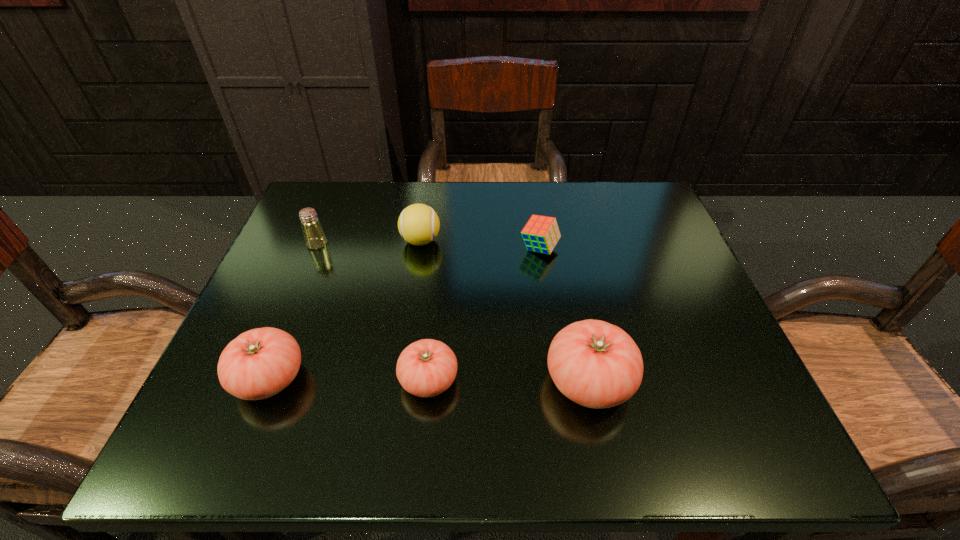
At what (x,y) coordinates should I click in order to perform the action: click on free point that keeps the tomatos evenly spaced on the right. Please return your answer as a coordinate pair (x, y). Image resolution: width=960 pixels, height=540 pixels. Looking at the image, I should click on tap(750, 383).